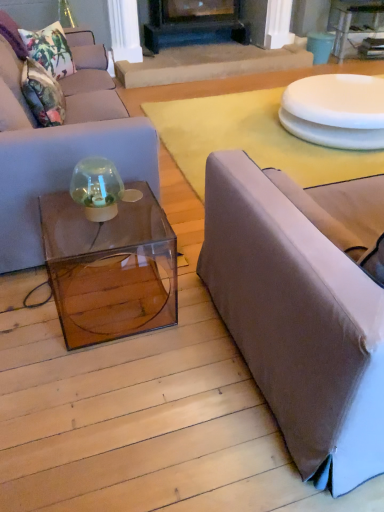
This screenshot has width=384, height=512. What do you see at coordinates (336, 111) in the screenshot?
I see `white glossy plate at upper right` at bounding box center [336, 111].

What is the approximate width of floral fabric cushion at upper left, which is counted as the second pillow, starting from the top?

9.83 inches.

Locate an element on the screen. Image resolution: width=384 pixels, height=512 pixels. black matte fireplace at center is located at coordinates (267, 22).

Where is `white glossy plate at upper right`? white glossy plate at upper right is located at coordinates (336, 111).

Which is correct: transparent glass table at upper right is inside black matte fireplace at center, or outside of it?

transparent glass table at upper right is not inside black matte fireplace at center, it's outside.

Who is taller, transparent glass table at upper right or black matte fireplace at center?

black matte fireplace at center.

From a real-world perspective, who is located lower, transparent glass table at upper right or black matte fireplace at center?

transparent glass table at upper right is physically lower.

Is transparent glass table at upper right turned away from black matte fireplace at center?

No, transparent glass table at upper right is not facing away from black matte fireplace at center.

Can we say floral fabric cushion at upper left, which is counted as the second pillow, starting from the top, lies outside floral fabric pillow at upper left, positioned as the 2th pillow in bottom-to-top order?

floral fabric cushion at upper left, which is counted as the second pillow, starting from the top, is positioned outside floral fabric pillow at upper left, positioned as the 2th pillow in bottom-to-top order.

How different are the orientations of floral fabric cushion at upper left, marked as the first pillow in a bottom-to-top arrangement, and floral fabric pillow at upper left, which is the first pillow from top to bottom, in degrees?

The facing directions of floral fabric cushion at upper left, marked as the first pillow in a bottom-to-top arrangement, and floral fabric pillow at upper left, which is the first pillow from top to bottom, are 45.4 degrees apart.

Between floral fabric cushion at upper left, which is counted as the second pillow, starting from the top, and floral fabric pillow at upper left, positioned as the 2th pillow in bottom-to-top order, which one appears on the right side from the viewer's perspective?

From the viewer's perspective, floral fabric cushion at upper left, which is counted as the second pillow, starting from the top, appears more on the right side.

From a real-world perspective, is matte gray couch at left, which is the second studio couch from right to left, located higher than transparent glass table at upper right?

Yes, from a real-world perspective, matte gray couch at left, which is the second studio couch from right to left, is over transparent glass table at upper right

Considering the positions of point (14, 116) and point (376, 1), is point (14, 116) closer or farther from the camera than point (376, 1)?

Point (14, 116) is closer to the camera than point (376, 1).

Is transparent acrylic cube at center behind brown fabric studio couch at right, arranged as the 1th studio couch when viewed from the right?

Yes, it is behind brown fabric studio couch at right, arranged as the 1th studio couch when viewed from the right.

From the picture: Which of these two, transparent acrylic cube at center or brown fabric studio couch at right, arranged as the 2th studio couch when viewed from the left, is thinner?

transparent acrylic cube at center.

Can you confirm if transparent acrylic cube at center is shorter than brown fabric studio couch at right, arranged as the 1th studio couch when viewed from the right?

Yes.

Considering the positions of objects floral fabric cushion at upper left, which is counted as the second pillow, starting from the top, and transparent acrylic cube at center in the image provided, who is more to the right, floral fabric cushion at upper left, which is counted as the second pillow, starting from the top, or transparent acrylic cube at center?

Positioned to the right is transparent acrylic cube at center.

Is floral fabric cushion at upper left, which is counted as the second pillow, starting from the top, oriented away from transparent acrylic cube at center?

No, floral fabric cushion at upper left, which is counted as the second pillow, starting from the top, is not facing the opposite direction of transparent acrylic cube at center.

In the scene shown: Is floral fabric cushion at upper left, which is counted as the second pillow, starting from the top, wider or thinner than transparent acrylic cube at center?

Clearly, floral fabric cushion at upper left, which is counted as the second pillow, starting from the top, has less width compared to transparent acrylic cube at center.

How distant is brown fabric studio couch at right, arranged as the 1th studio couch when viewed from the right, from white glossy plate at upper right?

5.24 feet.

Is the surface of brown fabric studio couch at right, arranged as the 1th studio couch when viewed from the right, in direct contact with white glossy plate at upper right?

brown fabric studio couch at right, arranged as the 1th studio couch when viewed from the right, and white glossy plate at upper right are clearly separated.

Could you tell me if brown fabric studio couch at right, arranged as the 2th studio couch when viewed from the left, is facing white glossy plate at upper right?

Yes, brown fabric studio couch at right, arranged as the 2th studio couch when viewed from the left, is oriented towards white glossy plate at upper right.

Which of these two, transparent glass table at upper right or white glossy plate at upper right, is wider?

white glossy plate at upper right is wider.

From the image's perspective, which is above, transparent glass table at upper right or white glossy plate at upper right?

transparent glass table at upper right.

Is transparent glass table at upper right positioned with its back to white glossy plate at upper right?

transparent glass table at upper right is not turned away from white glossy plate at upper right.

Is transparent glass table at upper right bigger than white glossy plate at upper right?

No, transparent glass table at upper right is not bigger than white glossy plate at upper right.

Find the location of a particular element. table below the black matte fireplace at center (from the image's perspective) is located at coordinates (354, 22).

Image resolution: width=384 pixels, height=512 pixels. In the image, there is a floral fabric pillow at upper left, positioned as the 2th pillow in bottom-to-top order. Identify the location of pillow below it (from a real-world perspective). (x=42, y=94).

Which object lies further to the anchor point floral fabric pillow at upper left, positioned as the 2th pillow in bottom-to-top order, matte gray couch at left, positioned as the 1th studio couch in left-to-right order, or brown fabric studio couch at right, arranged as the 2th studio couch when viewed from the left?

Among the two, brown fabric studio couch at right, arranged as the 2th studio couch when viewed from the left, is located further to floral fabric pillow at upper left, positioned as the 2th pillow in bottom-to-top order.

From the image, which object appears to be farther from white glossy plate at upper right, transparent acrylic cube at center or black matte fireplace at center?

black matte fireplace at center.

Which object lies further to the anchor point white glossy plate at upper right, transparent glass table at upper right or floral fabric pillow at upper left, which is the first pillow from top to bottom?

The object further to white glossy plate at upper right is transparent glass table at upper right.

Considering their positions, is white glossy plate at upper right positioned further to white glossy plate at upper right than floral fabric cushion at upper left, marked as the first pillow in a bottom-to-top arrangement?

floral fabric cushion at upper left, marked as the first pillow in a bottom-to-top arrangement, is positioned further to the anchor white glossy plate at upper right.

Looking at the image, which one is located further to brown fabric studio couch at right, arranged as the 2th studio couch when viewed from the left, floral fabric cushion at upper left, marked as the first pillow in a bottom-to-top arrangement, or white glossy plate at upper right?

floral fabric cushion at upper left, marked as the first pillow in a bottom-to-top arrangement.

Estimate the real-world distances between objects in this image. Which object is closer to brown fabric studio couch at right, arranged as the 1th studio couch when viewed from the right, matte gray couch at left, positioned as the 1th studio couch in left-to-right order, or black matte fireplace at center?

matte gray couch at left, positioned as the 1th studio couch in left-to-right order.

From the image, which object appears to be nearer to white glossy plate at upper right, brown fabric studio couch at right, arranged as the 2th studio couch when viewed from the left, or matte gray couch at left, positioned as the 1th studio couch in left-to-right order?

matte gray couch at left, positioned as the 1th studio couch in left-to-right order.

Based on their spatial positions, is floral fabric pillow at upper left, positioned as the 2th pillow in bottom-to-top order, or transparent glass table at upper right closer to brown fabric studio couch at right, arranged as the 1th studio couch when viewed from the right?

floral fabric pillow at upper left, positioned as the 2th pillow in bottom-to-top order, is positioned closer to the anchor brown fabric studio couch at right, arranged as the 1th studio couch when viewed from the right.

Identify the location of plain between brown fabric studio couch at right, arranged as the 1th studio couch when viewed from the right, and transparent glass table at upper right from front to back. This screenshot has width=384, height=512. (250, 139).

This screenshot has width=384, height=512. I want to click on plain located between floral fabric pillow at upper left, which is the first pillow from top to bottom, and white glossy plate at upper right in the left-right direction, so click(x=250, y=139).

Identify the location of plain between transparent acrylic cube at center and white glossy plate at upper right from left to right. This screenshot has height=512, width=384. (250, 139).

Locate an element on the screen. This screenshot has width=384, height=512. studio couch positioned between brown fabric studio couch at right, arranged as the 2th studio couch when viewed from the left, and white glossy plate at upper right from near to far is located at coordinates (61, 147).